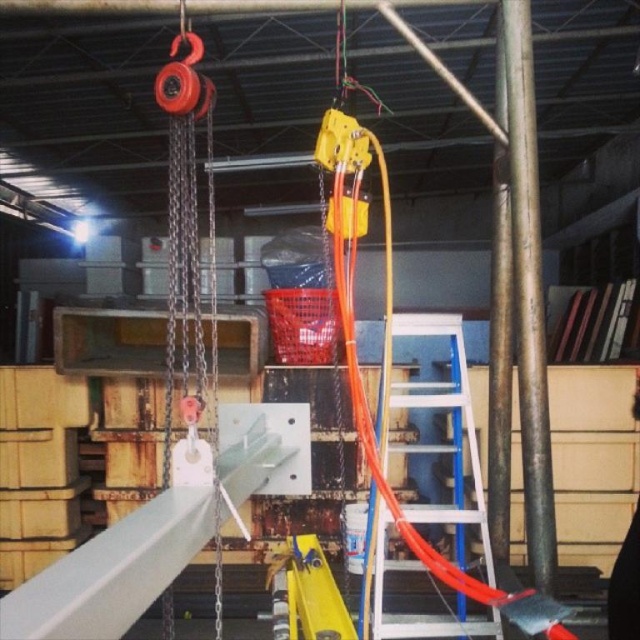
Question: Can you confirm if metallic pole at center-right is thinner than white plastic ladder at center?

Choices:
 (A) yes
 (B) no

Answer: (A)

Question: Which point appears closest to the camera in this image?

Choices:
 (A) (531, 477)
 (B) (372, 573)

Answer: (A)

Question: Which object appears farthest from the camera in this image?

Choices:
 (A) metallic pole at center-right
 (B) white plastic ladder at center

Answer: (A)

Question: Is metallic pole at center-right below white plastic ladder at center?

Choices:
 (A) yes
 (B) no

Answer: (B)

Question: Which of the following is the farthest from the observer?

Choices:
 (A) (508, 19)
 (B) (460, 634)

Answer: (A)

Question: Does metallic pole at center-right appear on the right side of white plastic ladder at center?

Choices:
 (A) no
 (B) yes

Answer: (B)